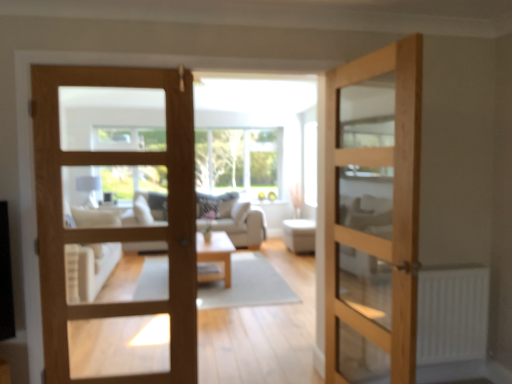
Question: Can you confirm if natural wood door at center, which is the second door from left to right, is bigger than light brown wooden door at center, which appears as the 2th door when viewed from the right?

Choices:
 (A) yes
 (B) no

Answer: (A)

Question: Is natural wood door at center, which is the second door from left to right, wider than light brown wooden door at center, which appears as the 2th door when viewed from the right?

Choices:
 (A) no
 (B) yes

Answer: (B)

Question: Is natural wood door at center, which is the second door from left to right, with light brown wooden door at center, the 1th door in the left-to-right sequence?

Choices:
 (A) no
 (B) yes

Answer: (A)

Question: From a real-world perspective, is natural wood door at center, which is the second door from left to right, under light brown wooden door at center, the 1th door in the left-to-right sequence?

Choices:
 (A) no
 (B) yes

Answer: (B)

Question: Does natural wood door at center, which is the second door from left to right, have a lesser height compared to light brown wooden door at center, which appears as the 2th door when viewed from the right?

Choices:
 (A) no
 (B) yes

Answer: (A)

Question: Is light brown wooden door at center, which appears as the 2th door when viewed from the right, completely or partially inside natural wood door at center, which is the second door from left to right?

Choices:
 (A) yes
 (B) no

Answer: (B)

Question: Does white matte radiator at lower right have a greater width compared to white fabric ottoman at center?

Choices:
 (A) yes
 (B) no

Answer: (B)

Question: Can you see white matte radiator at lower right touching white fabric ottoman at center?

Choices:
 (A) no
 (B) yes

Answer: (A)

Question: From a real-world perspective, is white matte radiator at lower right below white fabric ottoman at center?

Choices:
 (A) yes
 (B) no

Answer: (B)

Question: Can you confirm if white matte radiator at lower right is smaller than white fabric ottoman at center?

Choices:
 (A) yes
 (B) no

Answer: (A)

Question: From a real-world perspective, is white matte radiator at lower right located higher than white fabric ottoman at center?

Choices:
 (A) no
 (B) yes

Answer: (B)

Question: Could you tell me if white matte radiator at lower right is facing white fabric ottoman at center?

Choices:
 (A) yes
 (B) no

Answer: (B)

Question: From the image's perspective, does light wood/texture coffee table at center appear higher than white matte radiator at lower right?

Choices:
 (A) yes
 (B) no

Answer: (B)